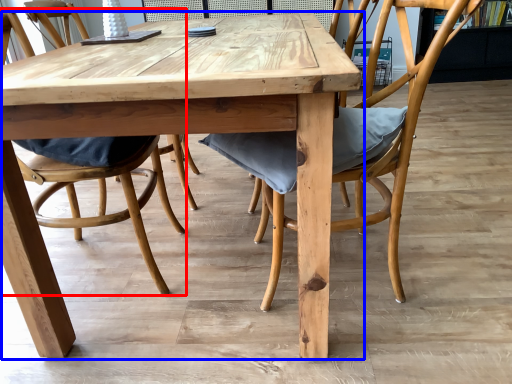
Question: Which of the following is the closest to the observer, chair (highlighted by a red box) or kitchen & dining room table (highlighted by a blue box)?

Choices:
 (A) chair
 (B) kitchen & dining room table

Answer: (B)